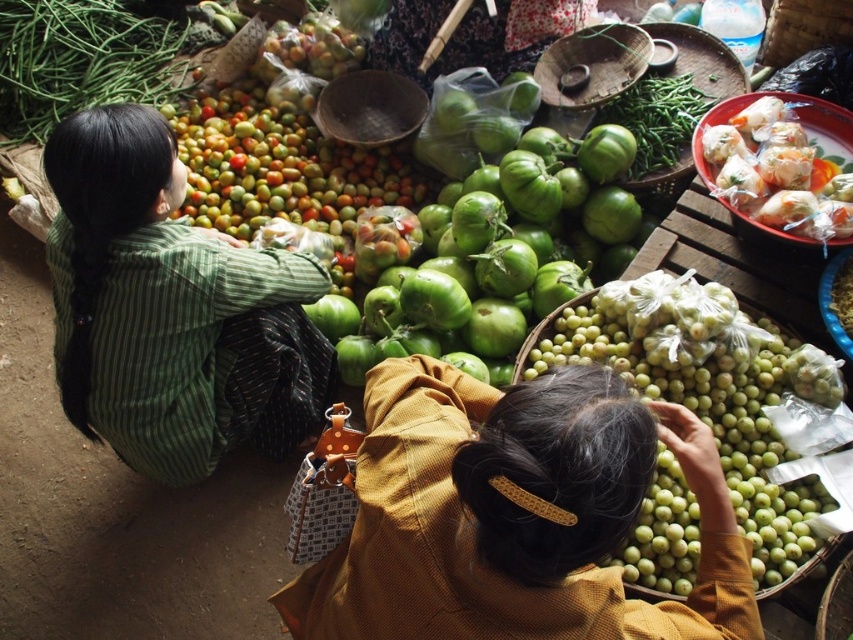
Question: Is matte yellow shirt at lower center positioned at the back of translucent plastic rolls at upper right?

Choices:
 (A) no
 (B) yes

Answer: (A)

Question: Among these points, which one is farthest from the camera?

Choices:
 (A) (775, 125)
 (B) (105, 368)

Answer: (A)

Question: Which point is farther to the camera?

Choices:
 (A) (810, 29)
 (B) (93, 296)
 (C) (729, 380)

Answer: (A)

Question: Does green matte grapes at lower right appear under green matte tomatoes at upper left?

Choices:
 (A) yes
 (B) no

Answer: (A)

Question: Is green striped shirt at left bigger than green string beans at upper left?

Choices:
 (A) no
 (B) yes

Answer: (B)

Question: Which of these objects is positioned closest to the green matte tomatoes at center?

Choices:
 (A) green matte tomatoes at upper left
 (B) green matte grapes at lower right

Answer: (A)